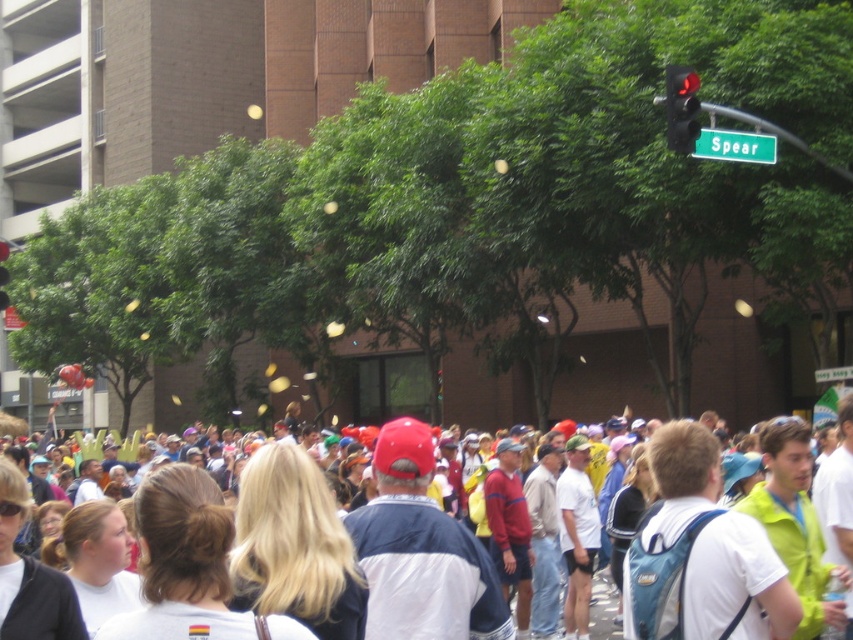
Question: Which point is closer to the camera?

Choices:
 (A) white cotton crowd at center
 (B) red glass traffic light at upper right
 (C) metallic red traffic light at upper right

Answer: (B)

Question: Based on their relative distances, which object is nearer to the white cotton crowd at center?

Choices:
 (A) red glass traffic light at upper right
 (B) metallic red traffic light at upper right

Answer: (A)

Question: Which of the following is the farthest from the observer?

Choices:
 (A) (0, 252)
 (B) (593, 636)
 (C) (677, 140)

Answer: (A)

Question: Does white cotton crowd at center appear on the right side of metallic red traffic light at upper right?

Choices:
 (A) no
 (B) yes

Answer: (B)

Question: Where is red glass traffic light at upper right located in relation to white cotton crowd at center in the image?

Choices:
 (A) right
 (B) left

Answer: (A)

Question: Can you confirm if white cotton crowd at center is positioned to the left of metallic red traffic light at upper right?

Choices:
 (A) yes
 (B) no

Answer: (B)